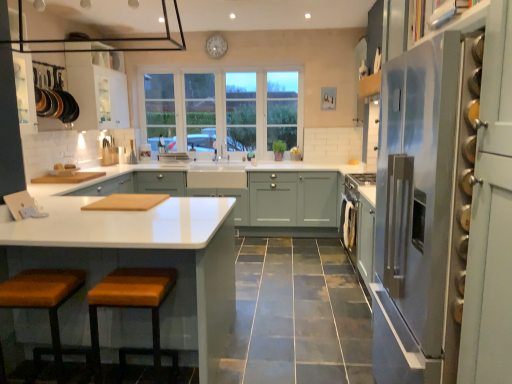
Find the location of a particular element. This screenshot has width=512, height=384. vacant space situated above leather cushioned stool at lower left, which ranks as the first stool in left-to-right order (from a real-world perspective) is located at coordinates (30, 287).